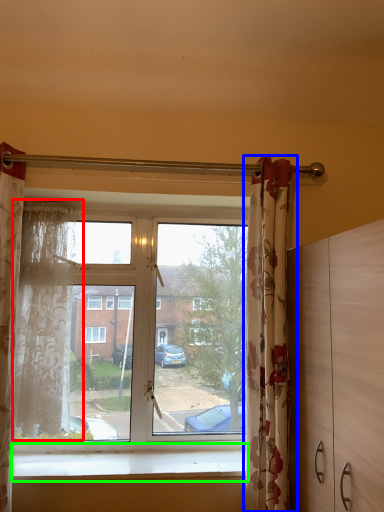
Question: Which is nearer to the curtain (highlighted by a red box)? curtain (highlighted by a blue box) or window sill (highlighted by a green box).

Choices:
 (A) curtain
 (B) window sill

Answer: (B)